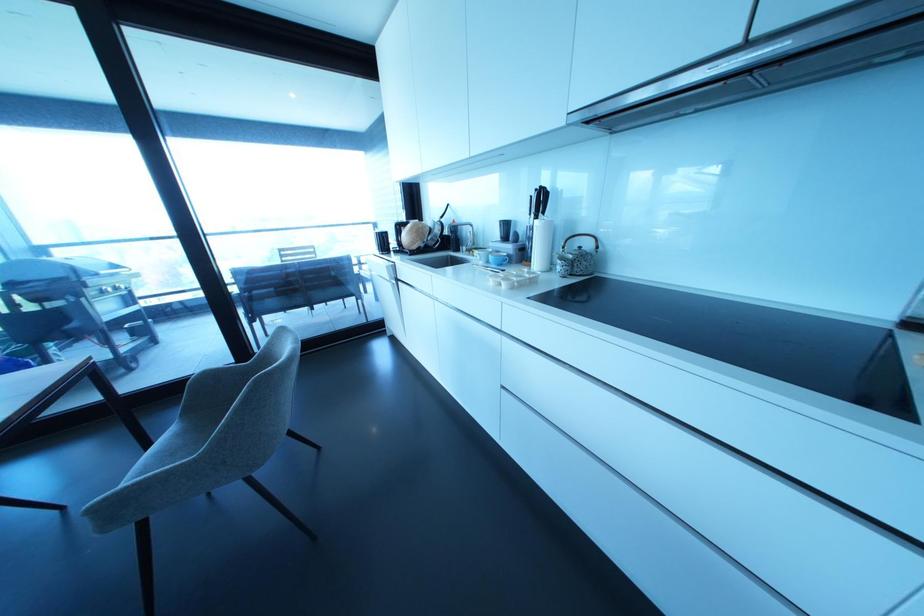
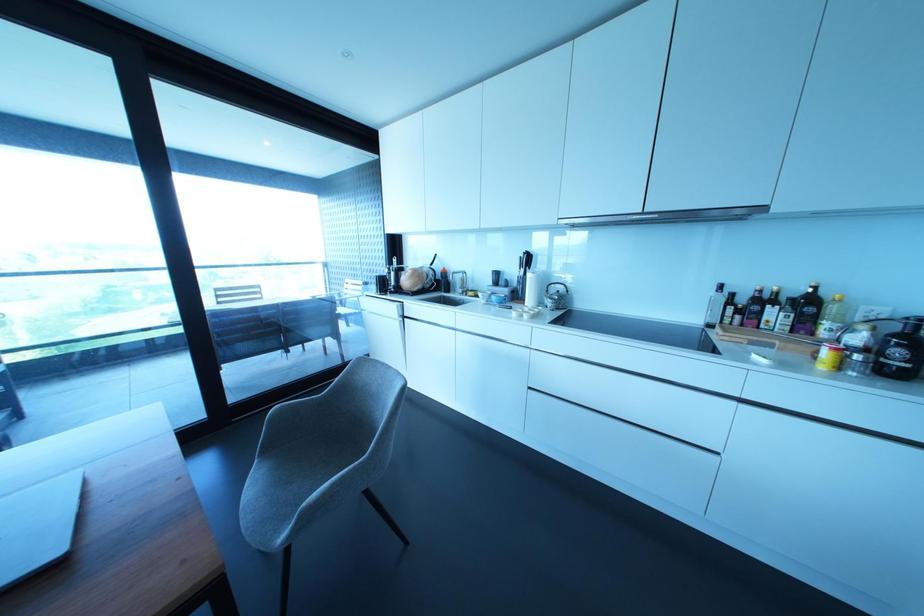
Locate, in the second image, the point that corresponds to (x=541, y=200) in the first image.

(527, 259)